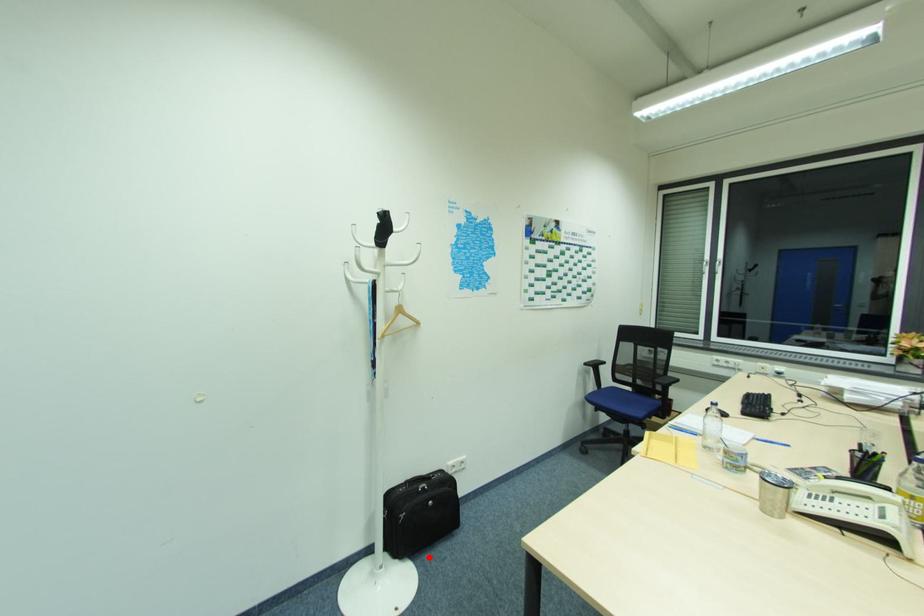
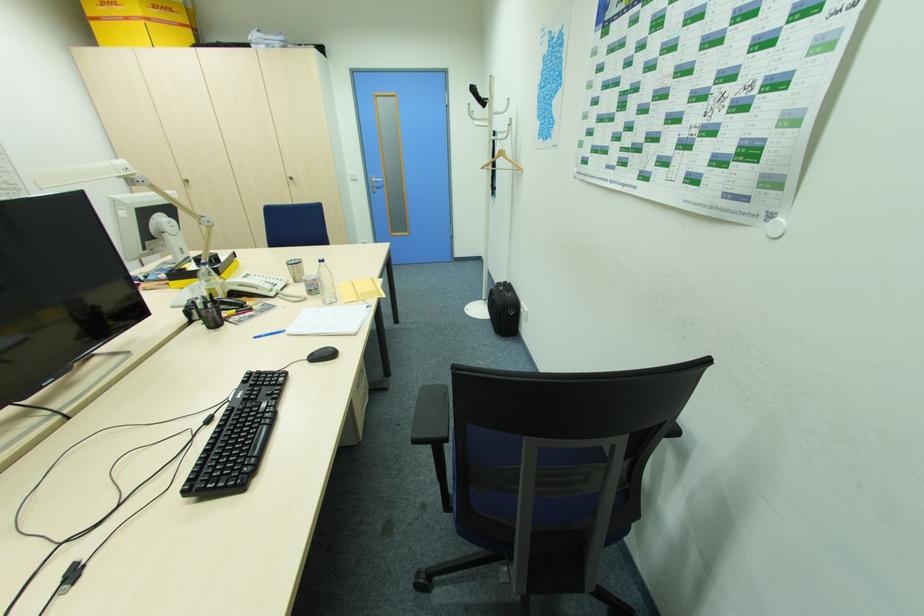
Find the pixel in the second image that matches the highlighted location in the first image.

(492, 325)